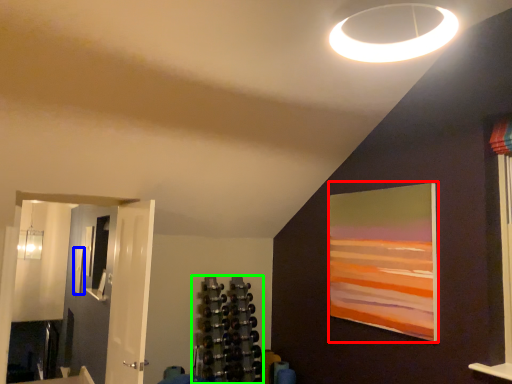
Question: Which is farther away from picture frame (highlighted by a red box)? picture frame (highlighted by a blue box) or shelf (highlighted by a green box)?

Choices:
 (A) picture frame
 (B) shelf

Answer: (A)